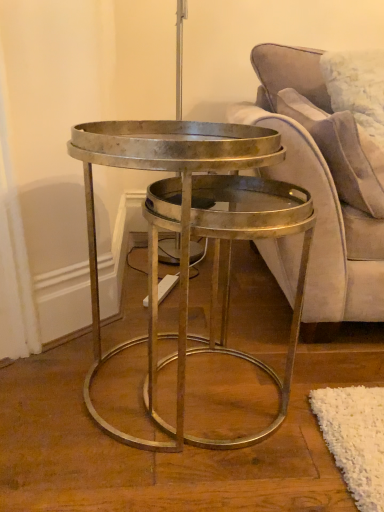
At what (x,y) coordinates should I click in order to perform the action: click on metallic/golden coffee table at center. Please return your answer as a coordinate pair (x, y). The image size is (384, 512). Looking at the image, I should click on (195, 233).

The image size is (384, 512). Describe the element at coordinates (195, 233) in the screenshot. I see `metallic/golden coffee table at center` at that location.

The image size is (384, 512). Describe the element at coordinates (325, 188) in the screenshot. I see `velvet purple couch at right` at that location.

Where is `metallic/golden coffee table at center`? This screenshot has width=384, height=512. metallic/golden coffee table at center is located at coordinates (195, 233).

Consider the image. Does velvet purple couch at right turn towards suede-like beige pillow at upper right?

Yes, velvet purple couch at right is aimed at suede-like beige pillow at upper right.

Which is correct: velvet purple couch at right is inside suede-like beige pillow at upper right, or outside of it?

velvet purple couch at right lies outside suede-like beige pillow at upper right.

In the image, is velvet purple couch at right on the left side or the right side of suede-like beige pillow at upper right?

In the image, velvet purple couch at right appears on the right side of suede-like beige pillow at upper right.

Looking at their sizes, would you say suede-like beige pillow at upper right is wider or thinner than velvet purple couch at right?

suede-like beige pillow at upper right is thinner than velvet purple couch at right.

Is point (352, 148) closer to viewer compared to point (318, 99)?

Yes, it is in front of point (318, 99).

Considering the relative sizes of suede-like beige pillow at upper right and velvet purple couch at right in the image provided, is suede-like beige pillow at upper right smaller than velvet purple couch at right?

Indeed, suede-like beige pillow at upper right has a smaller size compared to velvet purple couch at right.

In the scene shown: Is suede-like beige pillow at upper right behind velvet purple couch at right?

That is True.

Considering the sizes of velvet purple couch at right and metallic/golden coffee table at center in the image, is velvet purple couch at right taller or shorter than metallic/golden coffee table at center?

Clearly, velvet purple couch at right is taller compared to metallic/golden coffee table at center.

Considering the positions of objects velvet purple couch at right and metallic/golden coffee table at center in the image provided, who is more to the right, velvet purple couch at right or metallic/golden coffee table at center?

Positioned to the right is velvet purple couch at right.

Looking at this image, is metallic/golden coffee table at center inside velvet purple couch at right?

That's incorrect, metallic/golden coffee table at center is not inside velvet purple couch at right.

Is velvet purple couch at right in front of metallic/golden coffee table at center?

No, the depth of velvet purple couch at right is greater than that of metallic/golden coffee table at center.

Considering the sizes of objects metallic/golden coffee table at center and velvet purple couch at right in the image provided, who is wider, metallic/golden coffee table at center or velvet purple couch at right?

velvet purple couch at right.

This screenshot has height=512, width=384. I want to click on coffee table that appears on the left of velvet purple couch at right, so click(195, 233).

Does metallic/golden coffee table at center lie behind velvet purple couch at right?

No, metallic/golden coffee table at center is closer to the viewer.

From a real-world perspective, relative to velvet purple couch at right, is metallic/golden coffee table at center vertically above or below?

From a real-world perspective, metallic/golden coffee table at center is physically below velvet purple couch at right.

Consider the image. Between metallic/golden coffee table at center and suede-like beige pillow at upper right, which one has larger size?

metallic/golden coffee table at center.

Do you think metallic/golden coffee table at center is within suede-like beige pillow at upper right, or outside of it?

metallic/golden coffee table at center exists outside the volume of suede-like beige pillow at upper right.

From the image's perspective, is metallic/golden coffee table at center below suede-like beige pillow at upper right?

Yes.

Would you say suede-like beige pillow at upper right is a long distance from metallic/golden coffee table at center?

That's not correct — suede-like beige pillow at upper right is a little close to metallic/golden coffee table at center.

Does point (330, 155) lie in front of point (266, 180)?

No.

Is suede-like beige pillow at upper right to the right of metallic/golden coffee table at center from the viewer's perspective?

Correct, you'll find suede-like beige pillow at upper right to the right of metallic/golden coffee table at center.

Between suede-like beige pillow at upper right and metallic/golden coffee table at center, which one has smaller size?

suede-like beige pillow at upper right.

This screenshot has height=512, width=384. Find the location of `studio couch lying in front of the suede-like beige pillow at upper right`. studio couch lying in front of the suede-like beige pillow at upper right is located at coordinates (325, 188).

Find the location of a particular element. This screenshot has height=512, width=384. studio couch located underneath the suede-like beige pillow at upper right (from a real-world perspective) is located at coordinates (325, 188).

Looking at the image, which one is located further to velvet purple couch at right, suede-like beige pillow at upper right or metallic/golden coffee table at center?

Among the two, metallic/golden coffee table at center is located further to velvet purple couch at right.

Consider the image. When comparing their distances from metallic/golden coffee table at center, does suede-like beige pillow at upper right or velvet purple couch at right seem closer?

Among the two, velvet purple couch at right is located nearer to metallic/golden coffee table at center.

Based on their spatial positions, is metallic/golden coffee table at center or suede-like beige pillow at upper right further from velvet purple couch at right?

metallic/golden coffee table at center lies further to velvet purple couch at right than the other object.

From the image, which object appears to be farther from suede-like beige pillow at upper right, velvet purple couch at right or metallic/golden coffee table at center?

Based on the image, metallic/golden coffee table at center appears to be further to suede-like beige pillow at upper right.

Considering their positions, is metallic/golden coffee table at center positioned further to suede-like beige pillow at upper right than velvet purple couch at right?

The object further to suede-like beige pillow at upper right is metallic/golden coffee table at center.

Considering their positions, is velvet purple couch at right positioned closer to metallic/golden coffee table at center than suede-like beige pillow at upper right?

Among the two, velvet purple couch at right is located nearer to metallic/golden coffee table at center.

This screenshot has height=512, width=384. I want to click on pillow located between metallic/golden coffee table at center and velvet purple couch at right in the left-right direction, so click(342, 151).